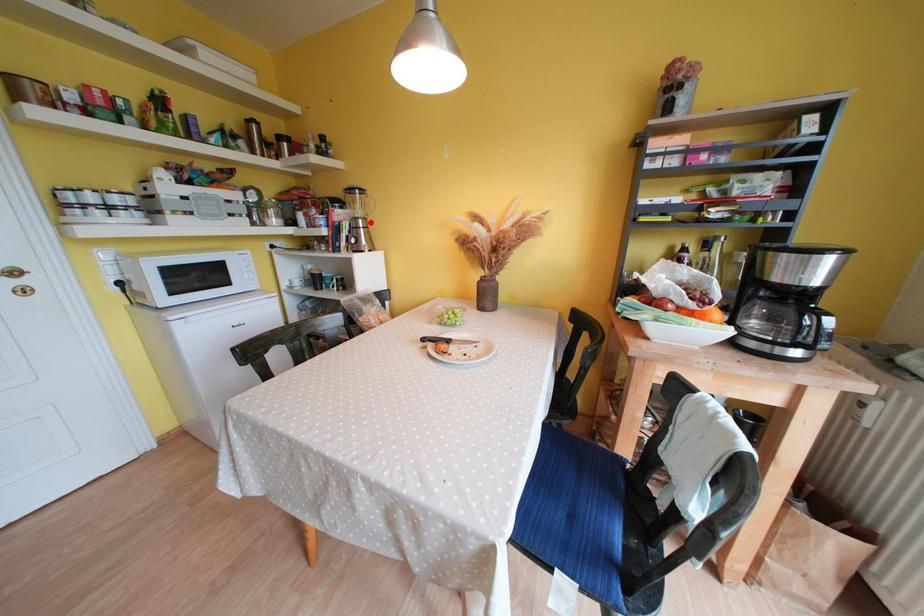
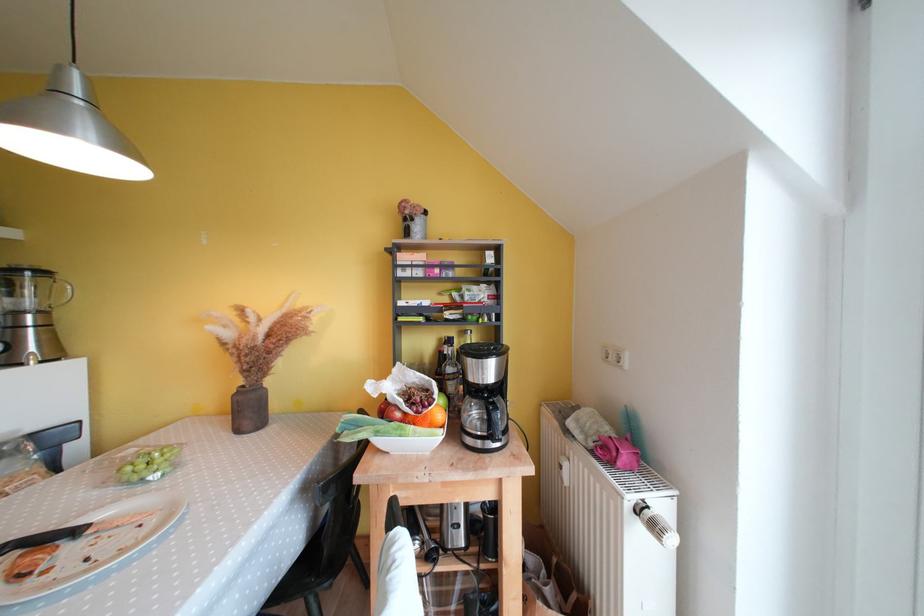
Question: I am providing you with two images of the same scene from different viewpoints. Given a red point in image1, look at the same physical point in image2. Is it:

Choices:
 (A) Closer to the viewpoint
 (B) Farther from the viewpoint

Answer: (B)